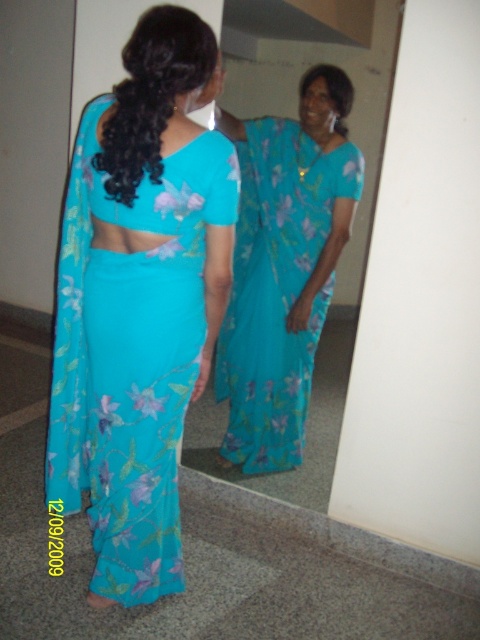
Is matte blue sari at back to the right of blue floral saree at center from the viewer's perspective?

In fact, matte blue sari at back is to the left of blue floral saree at center.

Is matte blue sari at back thinner than blue floral saree at center?

Yes, matte blue sari at back is thinner than blue floral saree at center.

The width and height of the screenshot is (480, 640). Describe the element at coordinates (139, 301) in the screenshot. I see `matte blue sari at back` at that location.

Where is `matte blue sari at back`? This screenshot has width=480, height=640. matte blue sari at back is located at coordinates (139, 301).